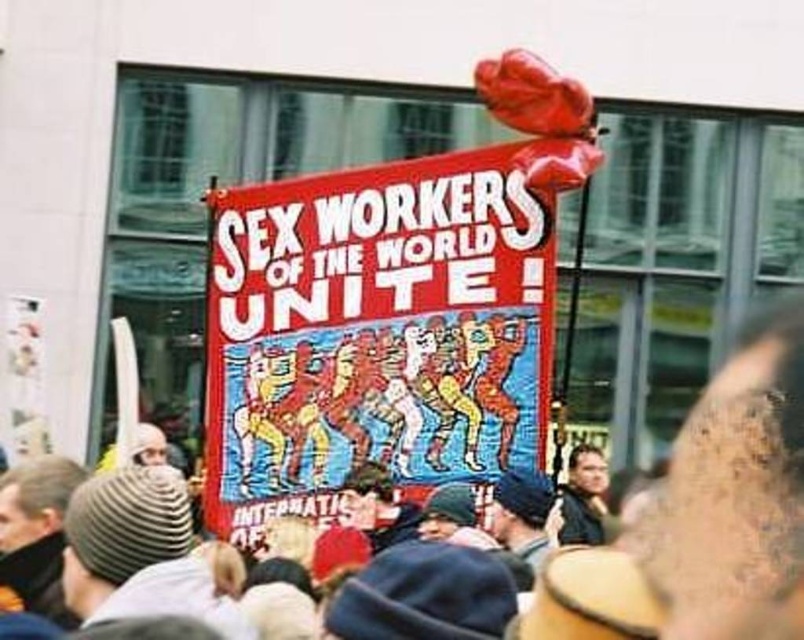
I want to click on brown leather jacket at center, so click(x=736, y=493).

Measure the distance between brown leather jacket at center and dark brown leather jacket at lower right.

brown leather jacket at center is 9.27 meters away from dark brown leather jacket at lower right.

What do you see at coordinates (736, 493) in the screenshot? Image resolution: width=804 pixels, height=640 pixels. I see `brown leather jacket at center` at bounding box center [736, 493].

Where is `brown leather jacket at center`? The height and width of the screenshot is (640, 804). brown leather jacket at center is located at coordinates (736, 493).

Between red fabric banner at center and dark brown leather jacket at lower right, which one appears on the right side from the viewer's perspective?

dark brown leather jacket at lower right is more to the right.

Is point (339, 448) positioned before point (593, 481)?

Yes, point (339, 448) is closer to viewer.

Describe the element at coordinates (378, 328) in the screenshot. I see `red fabric banner at center` at that location.

The image size is (804, 640). Find the location of `red fabric banner at center`. red fabric banner at center is located at coordinates (378, 328).

Can you confirm if red fabric banner at center is thinner than dark blue knit cap at center?

In fact, red fabric banner at center might be wider than dark blue knit cap at center.

Which of these two, red fabric banner at center or dark blue knit cap at center, stands shorter?

Standing shorter between the two is dark blue knit cap at center.

At what (x,y) coordinates should I click in order to perform the action: click on red fabric banner at center. Please return your answer as a coordinate pair (x, y). Looking at the image, I should click on (378, 328).

Identify the location of red fabric banner at center. This screenshot has width=804, height=640. tap(378, 328).